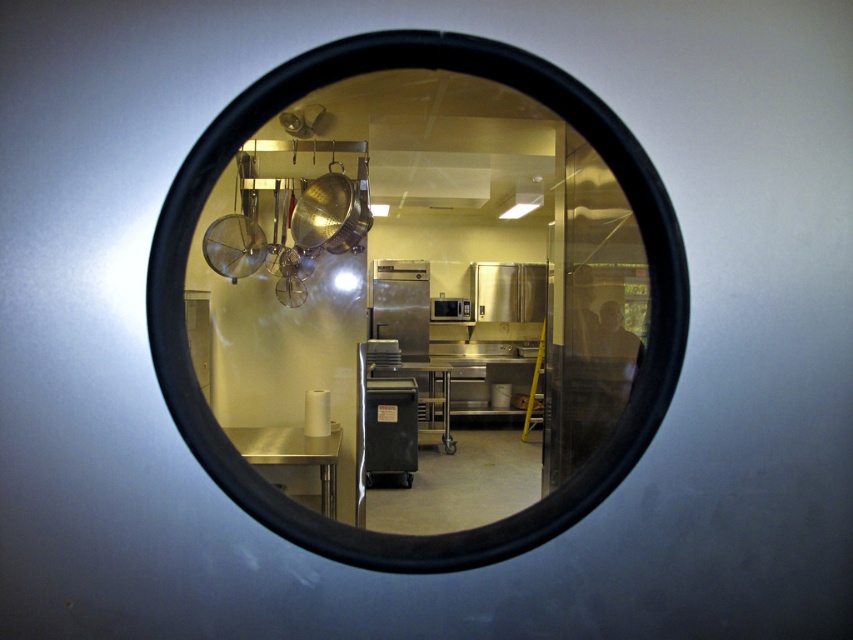
Describe the element at coordinates (390, 432) in the screenshot. This screenshot has width=853, height=640. I see `black plastic cart at center` at that location.

Does black plastic cart at center appear under stainless steel appliance at center?

Yes.

Is point (364, 461) more distant than point (404, 305)?

No.

What are the coordinates of `black plastic cart at center` in the screenshot? It's located at (390, 432).

Between stainless steel pots at upper center and black plastic cart at center, which one is positioned lower?

stainless steel pots at upper center is lower down.

Can you confirm if stainless steel pots at upper center is shorter than black plastic cart at center?

Yes, stainless steel pots at upper center is shorter than black plastic cart at center.

Which is behind, point (560, 451) or point (410, 472)?

The point (410, 472) is more distant.

In order to click on stainless steel pots at upper center in this screenshot , I will do `click(428, 292)`.

Is stainless steel appliance at center wider than satin silver microwave at center?

Yes.

Can you confirm if stainless steel appliance at center is shorter than satin silver microwave at center?

In fact, stainless steel appliance at center may be taller than satin silver microwave at center.

Between point (372, 289) and point (465, 301), which one is positioned in front?

Point (372, 289) is in front.

This screenshot has width=853, height=640. I want to click on stainless steel appliance at center, so click(x=401, y=305).